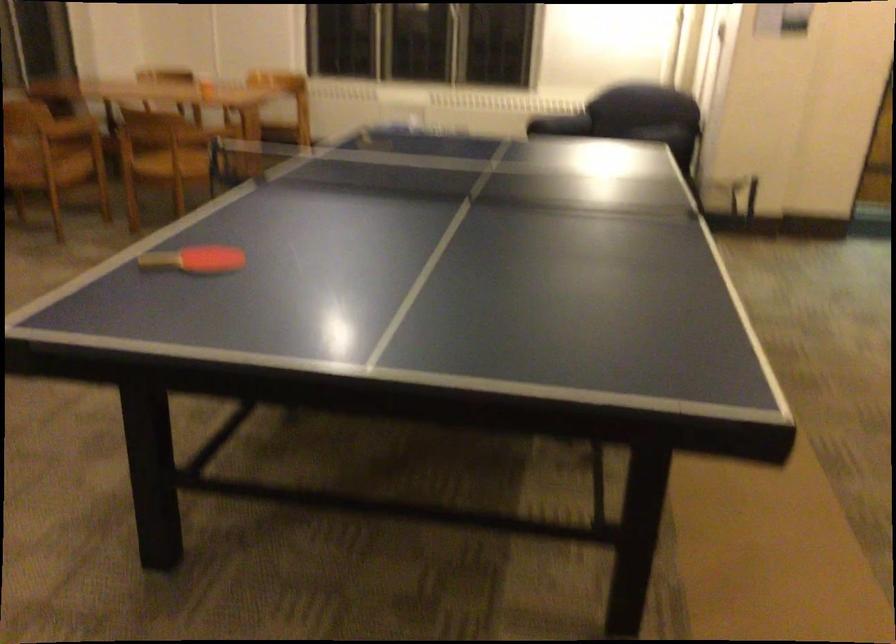
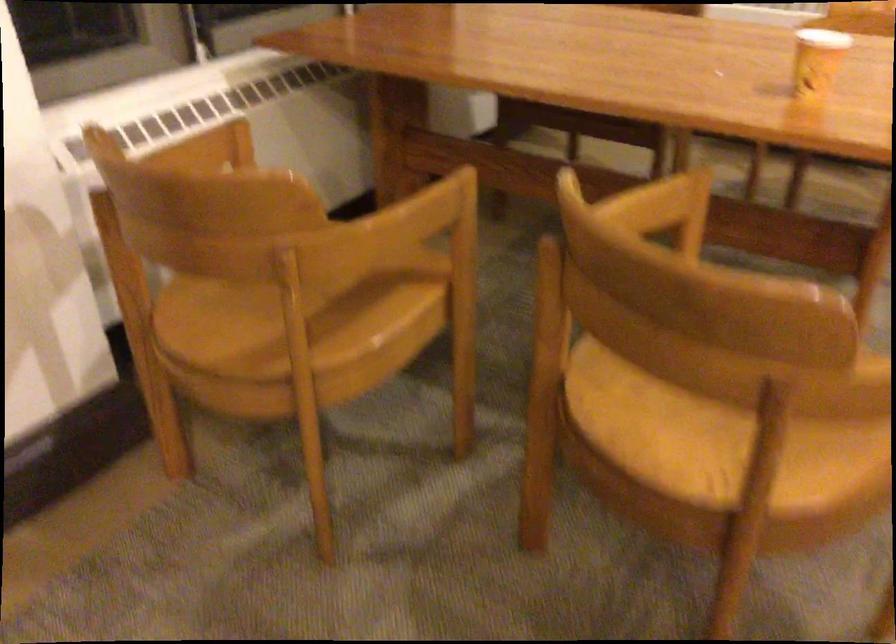
What movement of the cameraman would produce the second image?

The movement direction of the cameraman is left, forward.